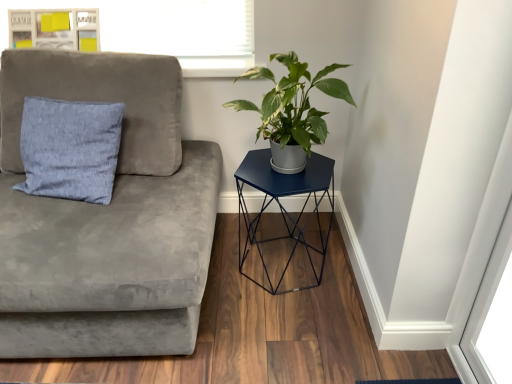
Question: In the image, is suede gray couch at left positioned in front of or behind wooden frame at upper left?

Choices:
 (A) behind
 (B) front

Answer: (B)

Question: Looking at the image, does suede gray couch at left seem bigger or smaller compared to wooden frame at upper left?

Choices:
 (A) small
 (B) big

Answer: (B)

Question: Which of these objects is positioned farthest from the metallic blue hexagonal table at right?

Choices:
 (A) green matte plant at upper right
 (B) light blue fabric pillow at left
 (C) wooden frame at upper left
 (D) suede gray couch at left

Answer: (C)

Question: Which object is positioned farthest from the metallic blue hexagonal table at right?

Choices:
 (A) light blue fabric pillow at left
 (B) green matte plant at upper right
 (C) suede gray couch at left
 (D) wooden frame at upper left

Answer: (D)